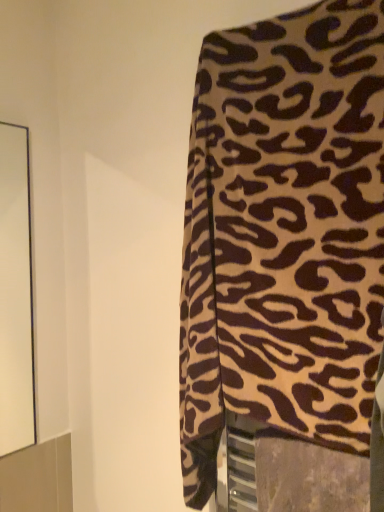
What do you see at coordinates (284, 234) in the screenshot?
I see `leopard print fabric at upper right` at bounding box center [284, 234].

Measure the distance between point (367, 408) and camera.

24.76 inches.

Where is `leopard print fabric at upper right`? The image size is (384, 512). leopard print fabric at upper right is located at coordinates (284, 234).

You are a GUI agent. You are given a task and a screenshot of the screen. Output one action in this format:
    pyautogui.click(x=<x>, y=<y>)
    Task: Click on the leopard print fabric at upper right
    The height and width of the screenshot is (512, 384).
    Given the screenshot: What is the action you would take?
    pyautogui.click(x=284, y=234)